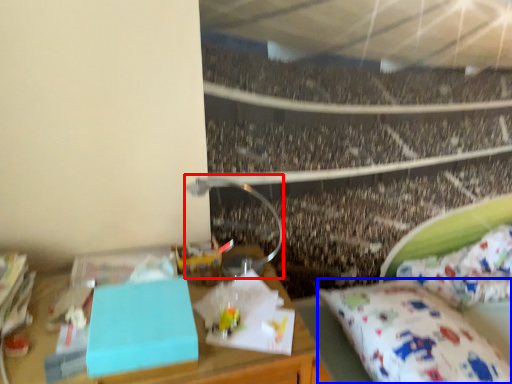
Question: Which point is further to the camera, lamp (highlighted by a red box) or mattress (highlighted by a blue box)?

Choices:
 (A) lamp
 (B) mattress

Answer: (A)